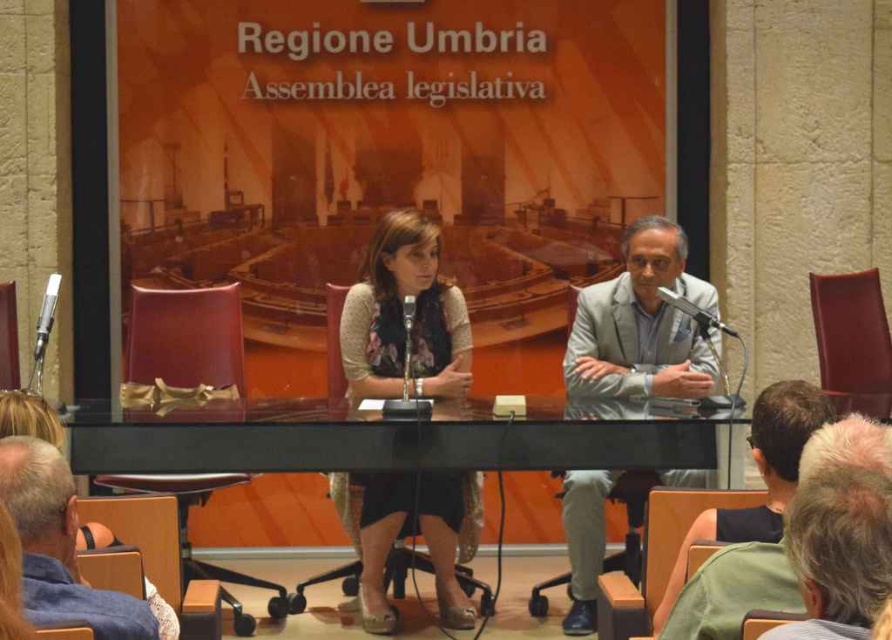
Does point (559, 422) come behind point (39, 323)?

No, it is not.

Between black glass table at center and metallic silver microphone at left, which one has less height?

With less height is black glass table at center.

This screenshot has height=640, width=892. Identify the location of black glass table at center. (391, 440).

Locate an element on the screen. The image size is (892, 640). black glass table at center is located at coordinates (391, 440).

Is dark gray suit at center positioned behind black plastic microphone at center?

That is False.

Is dark gray suit at center to the right of black plastic microphone at center from the viewer's perspective?

Yes, dark gray suit at center is to the right of black plastic microphone at center.

Locate an element on the screen. The width and height of the screenshot is (892, 640). dark gray suit at center is located at coordinates (761, 477).

Identify the location of dark gray suit at center. (761, 477).

The width and height of the screenshot is (892, 640). I want to click on gray hair at lower right, so click(840, 531).

Is point (837, 492) closer to viewer compared to point (672, 595)?

That is True.

Find the location of a particular element. gray hair at lower right is located at coordinates (840, 531).